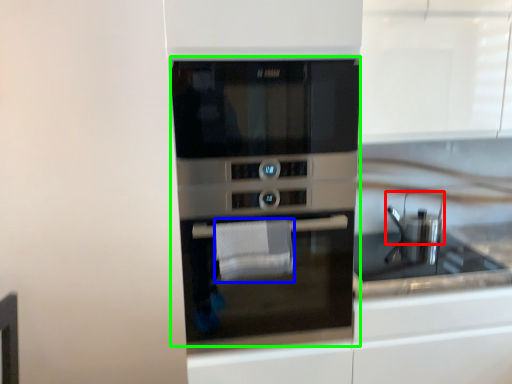
Question: Based on their relative distances, which object is nearer to appliance (highlighted by a red box)? Choose from hand towel (highlighted by a blue box) and oven (highlighted by a green box).

Choices:
 (A) hand towel
 (B) oven

Answer: (B)